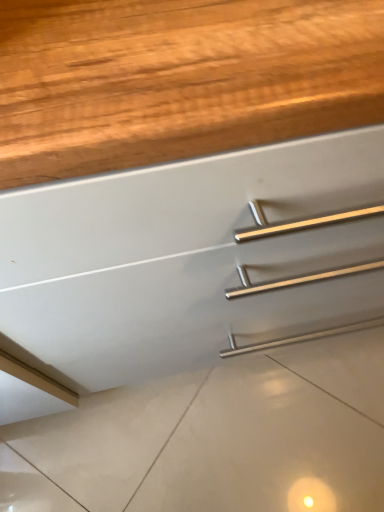
What is the approximate height of satin nickel drawer at center?

The height of satin nickel drawer at center is 33.80 inches.

Locate an element on the screen. Image resolution: width=384 pixels, height=512 pixels. satin nickel drawer at center is located at coordinates point(193,258).

What do you see at coordinates (193, 258) in the screenshot? The height and width of the screenshot is (512, 384). I see `satin nickel drawer at center` at bounding box center [193, 258].

This screenshot has height=512, width=384. Identify the location of satin nickel drawer at center. (193, 258).